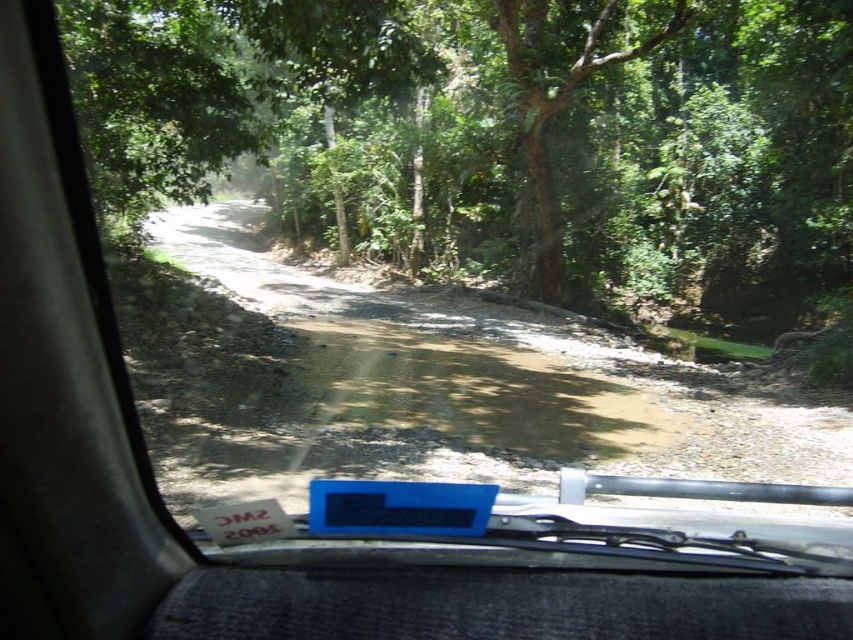
You are driving a car and notice a green leafy tree at center through the windshield. Based on its position on the windshield, can you determine if the tree is directly ahead of the car or slightly to one side?

The green leafy tree at center is located at point coordinates approximately 0.209 on the x and 0.589 on the y axis. Since the coordinates are near the center of the windshield, the tree is likely directly ahead of the car.

You are driving a car and want to know if you can see the green leafy tree at center through the windshield without looking away from the brown gravel dirt track at center. Based on their positions, can you see both at the same time?

The green leafy tree at center is further to the viewer than brown gravel dirt track at center, so yes, you can see both the green leafy tree at center and the brown gravel dirt track at center at the same time through the windshield.

In the scene shown: You are driving a car and notice two objects in front of you through the windshield. You need to determine which one is wider. Which object is wider between the green leafy tree at center and the brown gravel dirt track at center?

The green leafy tree at center is wider than the brown gravel dirt track at center according to the description.